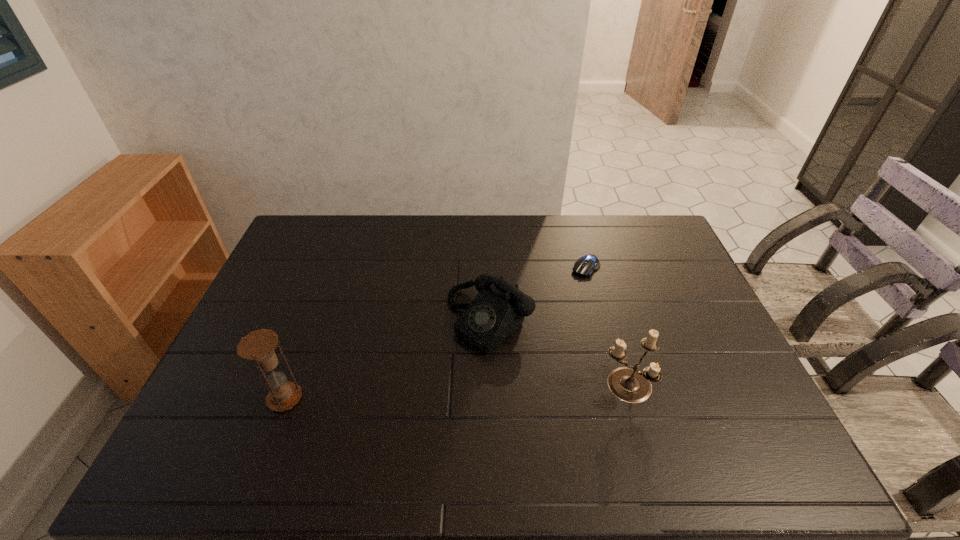
I want to click on free spot on the desktop that is between the hourglass and the second tallest object and is positioned on the button side of the computer mouse, so click(x=470, y=392).

You are a GUI agent. You are given a task and a screenshot of the screen. Output one action in this format:
    pyautogui.click(x=<x>, y=<y>)
    Task: Click on the free spot on the desktop that is between the hourglass and the candle holder and is positioned on the dial of the second object from left to right
    This screenshot has height=540, width=960.
    Given the screenshot: What is the action you would take?
    pyautogui.click(x=407, y=394)